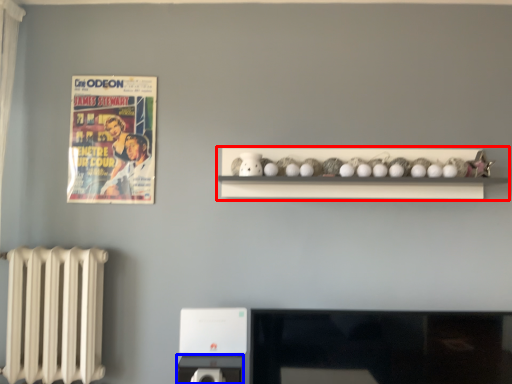
Question: Which of the following is the closest to the observer, shelf (highlighted by a red box) or appliance (highlighted by a blue box)?

Choices:
 (A) shelf
 (B) appliance

Answer: (B)